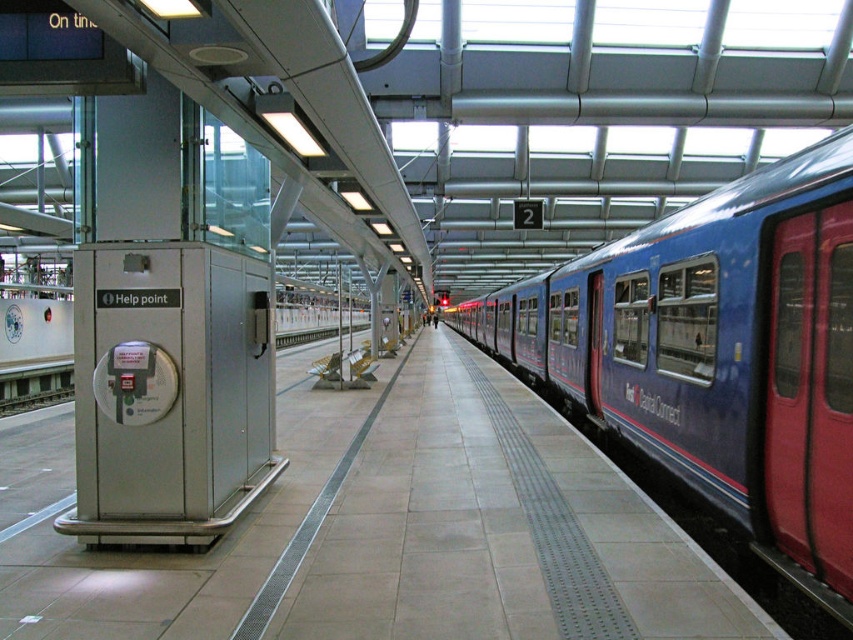
Looking at this image, you are standing on the platform and want to board the blue metallic train at center. Which direction should you walk to reach it from the smooth concrete platform at center?

You should walk to the right from the smooth concrete platform at center to reach the blue metallic train at center because the platform is to the left of the train.

In the scene shown: You are standing on the platform at the train station. There are two points marked on the platform. The first point is at coordinates point (383, 442) and the second point is at point (689, 316). If you were to walk from the help point booth towards the train, which point would you encounter first?

Point (383, 442) is further to the viewer than point (689, 316). Since you are walking from the help point booth towards the train, you would encounter the point that is closer to your starting position first. Therefore, you would reach point (383, 442) before point (689, 316).